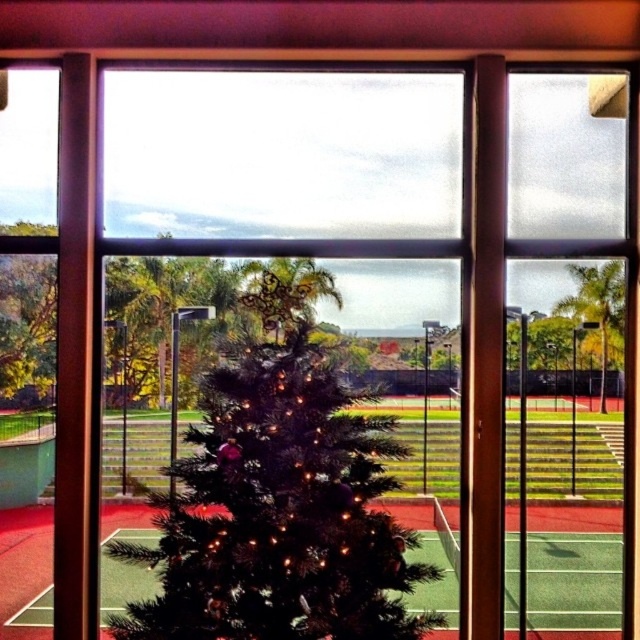
Question: Can you confirm if green artificial turf at center is positioned to the left of green matte tree at left?

Choices:
 (A) yes
 (B) no

Answer: (B)

Question: Among these objects, which one is nearest to the camera?

Choices:
 (A) green matte christmas tree at center
 (B) green matte tree at left
 (C) green artificial turf at center

Answer: (A)

Question: Which point is farther from the camera taking this photo?

Choices:
 (A) (228, 426)
 (B) (618, 637)

Answer: (B)

Question: Observing the image, what is the correct spatial positioning of green matte christmas tree at center in reference to green artificial turf at center?

Choices:
 (A) above
 (B) below

Answer: (A)

Question: Which point is closer to the camera?

Choices:
 (A) green matte christmas tree at center
 (B) green matte tree at left
 (C) green artificial turf at center

Answer: (A)

Question: From the image, what is the correct spatial relationship of green matte christmas tree at center in relation to green artificial turf at center?

Choices:
 (A) below
 (B) above

Answer: (B)